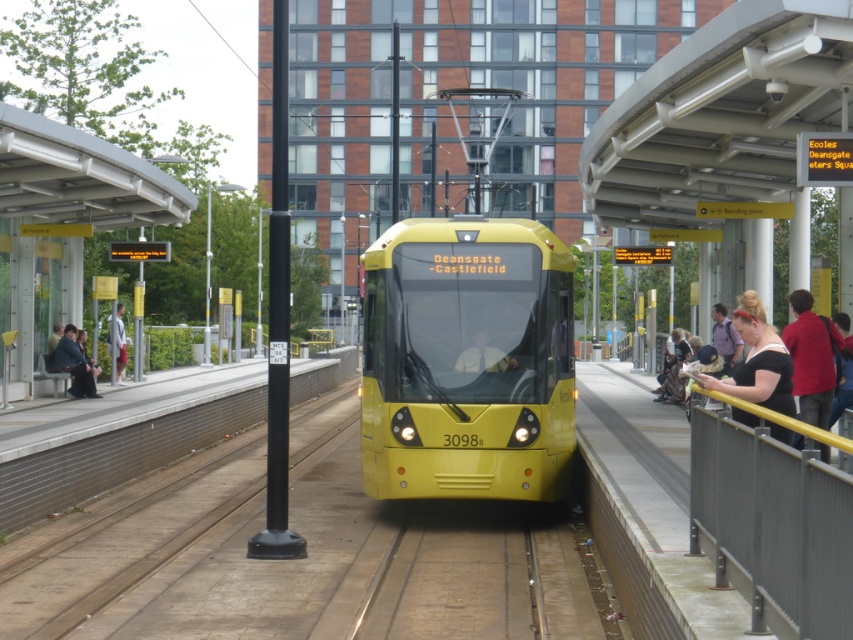
How distant is yellow fabric face at center from light gray fabric jacket at left?

yellow fabric face at center and light gray fabric jacket at left are 43.16 feet apart from each other.

Is yellow fabric face at center taller than light gray fabric jacket at left?

No.

The image size is (853, 640). What do you see at coordinates (483, 356) in the screenshot?
I see `yellow fabric face at center` at bounding box center [483, 356].

Locate an element on the screen. The image size is (853, 640). yellow fabric face at center is located at coordinates (483, 356).

Between point (404, 289) and point (479, 364), which one is positioned in front?

Point (479, 364) is in front.

Is yellow matte train at center bigger than yellow fabric face at center?

Yes.

What do you see at coordinates (457, 355) in the screenshot? This screenshot has width=853, height=640. I see `yellow matte train at center` at bounding box center [457, 355].

At what (x,y) coordinates should I click in order to perform the action: click on yellow matte train at center. Please return your answer as a coordinate pair (x, y). This screenshot has width=853, height=640. Looking at the image, I should click on (457, 355).

Who is positioned more to the right, yellow matte train at center or light gray fabric jacket at left?

Positioned to the right is yellow matte train at center.

Does yellow matte train at center have a lesser height compared to light gray fabric jacket at left?

No, yellow matte train at center is not shorter than light gray fabric jacket at left.

What do you see at coordinates (457, 355) in the screenshot?
I see `yellow matte train at center` at bounding box center [457, 355].

Image resolution: width=853 pixels, height=640 pixels. What are the coordinates of `yellow matte train at center` in the screenshot? It's located at pos(457,355).